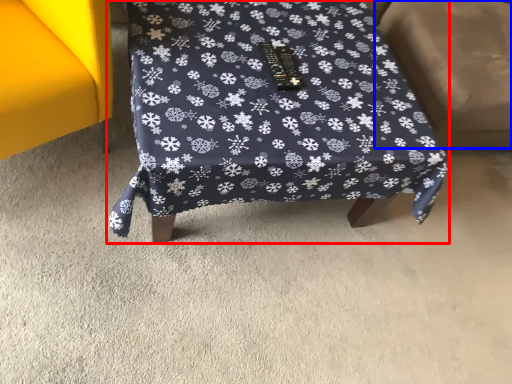
Question: Which object appears farthest to the camera in this image, furniture (highlighted by a red box) or swivel chair (highlighted by a blue box)?

Choices:
 (A) furniture
 (B) swivel chair

Answer: (B)